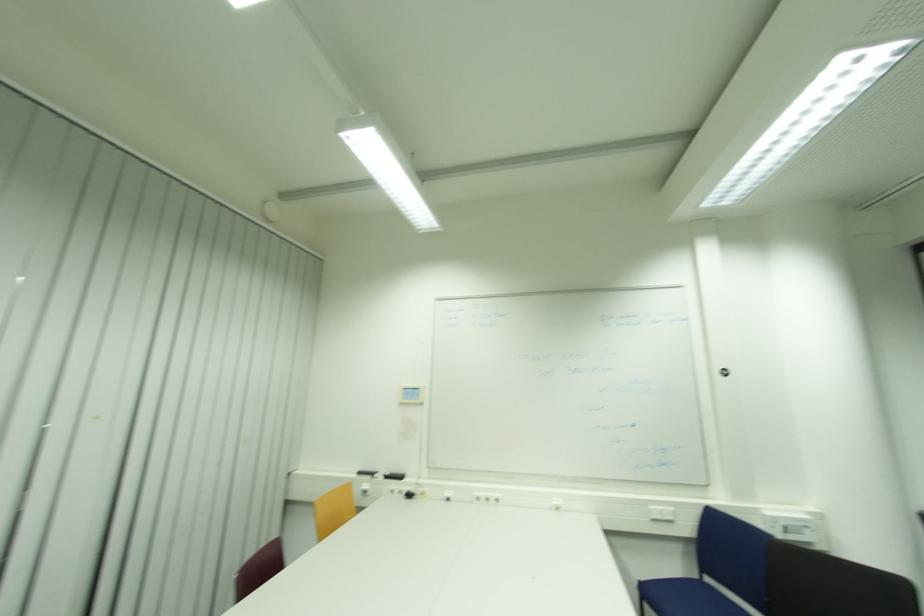
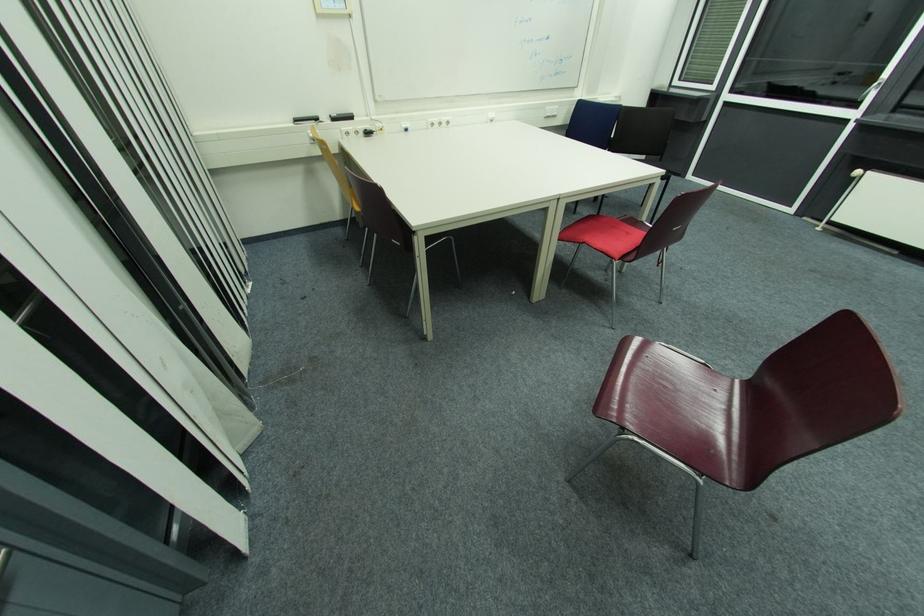
Locate, in the second image, the point that corresponds to the point at 362,474 in the first image.

(300, 121)